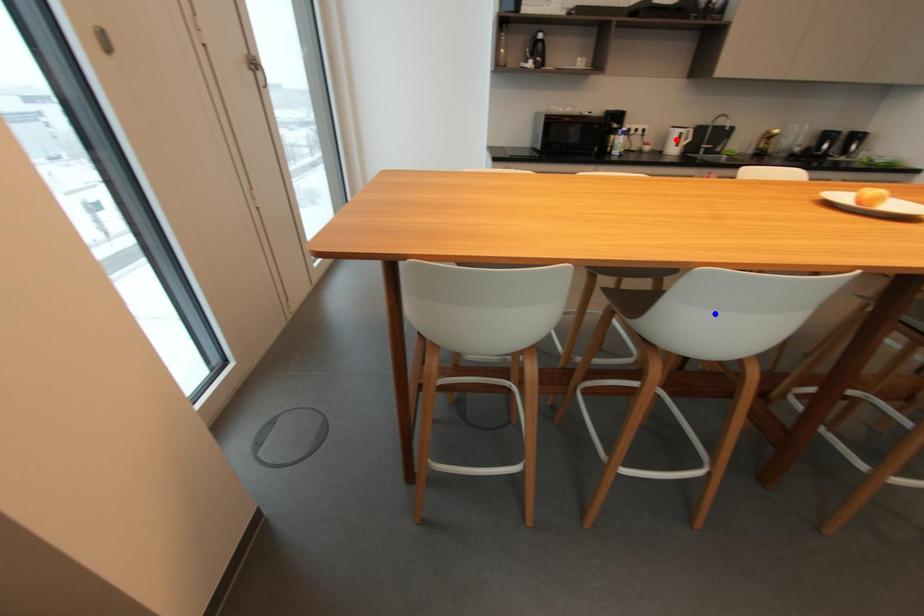
Question: Which of the two points in the image is closer to the camera?

Choices:
 (A) Blue point is closer.
 (B) Red point is closer.

Answer: (A)